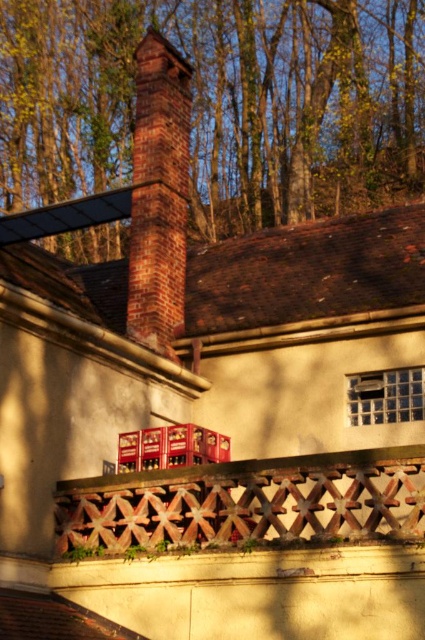
Can you confirm if wooden lattice at center is positioned to the right of red brick chimney at center?

Yes, wooden lattice at center is to the right of red brick chimney at center.

Who is more forward, (57, 532) or (147, 236)?

Point (57, 532) is in front.

The width and height of the screenshot is (425, 640). What do you see at coordinates (246, 502) in the screenshot?
I see `wooden lattice at center` at bounding box center [246, 502].

Where is `wooden lattice at center`? Image resolution: width=425 pixels, height=640 pixels. wooden lattice at center is located at coordinates (246, 502).

Is brown wood tree at upper center above red brick chimney at center?

Correct, brown wood tree at upper center is located above red brick chimney at center.

Does brown wood tree at upper center have a lesser width compared to red brick chimney at center?

Incorrect, brown wood tree at upper center's width is not less than red brick chimney at center's.

Which is behind, point (2, 172) or point (183, 237)?

The point (2, 172) is behind.

Where is `brown wood tree at upper center`? Image resolution: width=425 pixels, height=640 pixels. brown wood tree at upper center is located at coordinates tap(220, 104).

Who is taller, brown wood tree at upper center or wooden lattice at center?

brown wood tree at upper center is taller.

Can you confirm if brown wood tree at upper center is positioned to the right of wooden lattice at center?

Incorrect, brown wood tree at upper center is not on the right side of wooden lattice at center.

What do you see at coordinates (220, 104) in the screenshot? I see `brown wood tree at upper center` at bounding box center [220, 104].

What are the coordinates of `brown wood tree at upper center` in the screenshot? It's located at (220, 104).